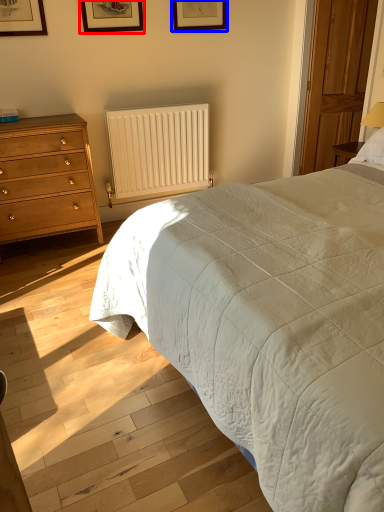
Question: Which object appears closest to the camera in this image, picture frame (highlighted by a red box) or picture frame (highlighted by a blue box)?

Choices:
 (A) picture frame
 (B) picture frame

Answer: (A)